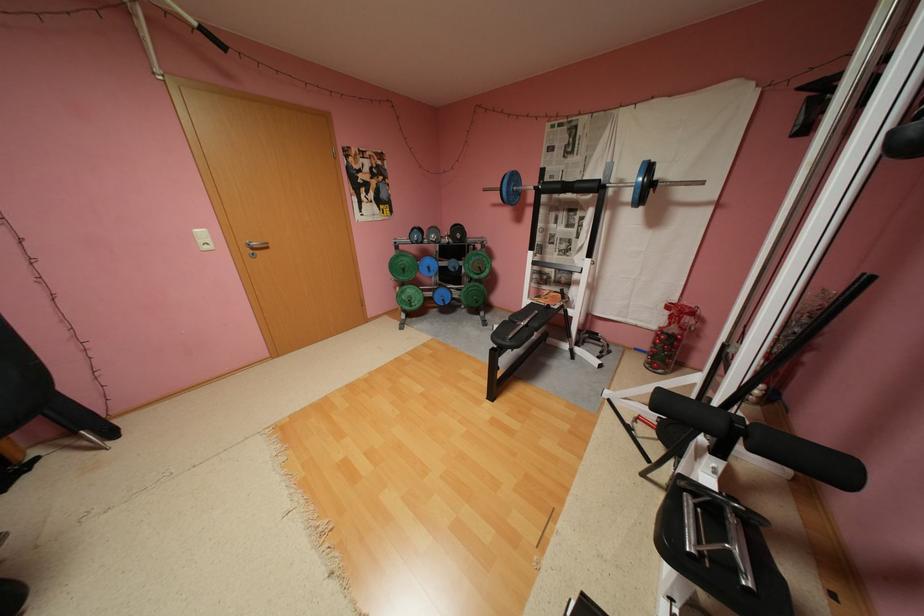
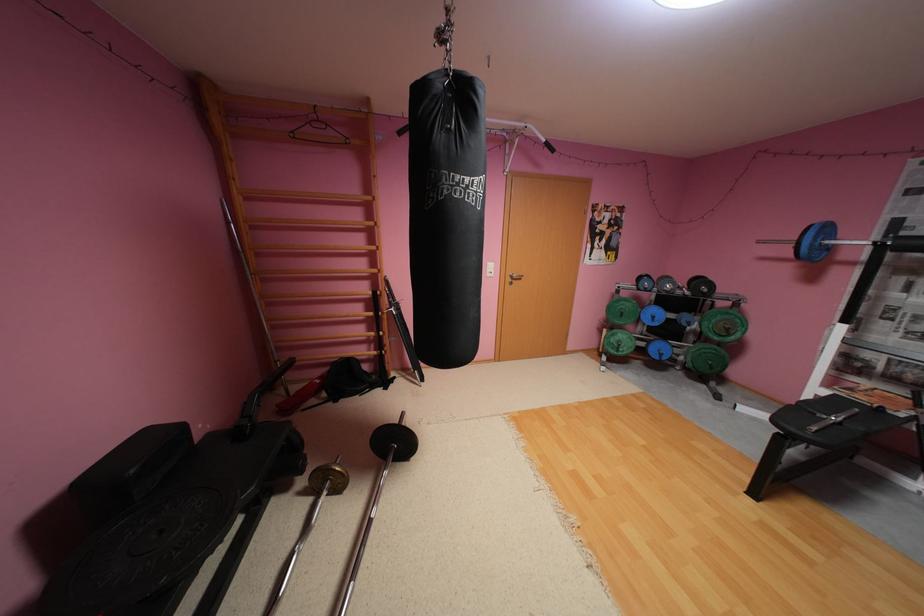
Where in the second image is the point corresponding to point (523, 177) from the first image?

(835, 229)